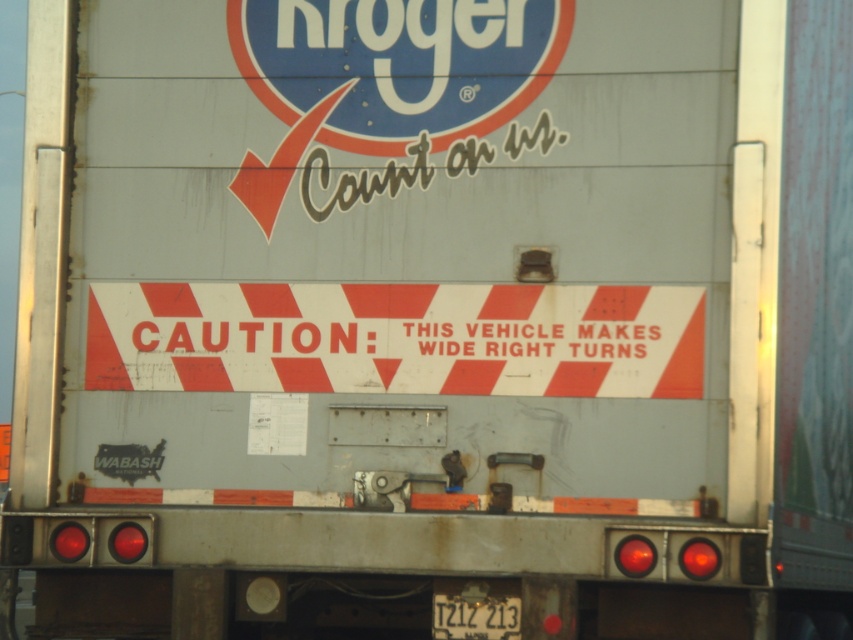
You are a pedestrian standing at the point with coordinates point (575, 321). You want to cross the street to reach the point with coordinates point (473, 598). Based on the truck and its wide right turn warning, which direction should you move to safely avoid the truck?

Since point (575, 321) is in front of point (473, 598), the truck will make a wide right turn, so you should move to the left side of the road to safely avoid the truck.